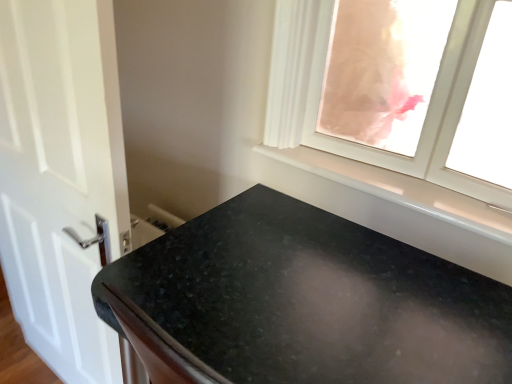
Question: From the image's perspective, is transparent glass window at upper right below black granite countertop at lower center?

Choices:
 (A) yes
 (B) no

Answer: (B)

Question: From a real-world perspective, is transparent glass window at upper right physically below black granite countertop at lower center?

Choices:
 (A) yes
 (B) no

Answer: (B)

Question: Does transparent glass window at upper right appear on the right side of black granite countertop at lower center?

Choices:
 (A) yes
 (B) no

Answer: (A)

Question: Considering the relative sizes of transparent glass window at upper right and black granite countertop at lower center in the image provided, is transparent glass window at upper right shorter than black granite countertop at lower center?

Choices:
 (A) yes
 (B) no

Answer: (A)

Question: Is transparent glass window at upper right bigger than black granite countertop at lower center?

Choices:
 (A) yes
 (B) no

Answer: (B)

Question: Can black granite countertop at lower center be found inside transparent glass window at upper right?

Choices:
 (A) yes
 (B) no

Answer: (B)

Question: Considering the relative sizes of white glossy door at left and white glossy window sill at upper right in the image provided, is white glossy door at left thinner than white glossy window sill at upper right?

Choices:
 (A) yes
 (B) no

Answer: (A)

Question: Considering the relative positions of white glossy door at left and white glossy window sill at upper right in the image provided, is white glossy door at left behind white glossy window sill at upper right?

Choices:
 (A) yes
 (B) no

Answer: (B)

Question: Is white glossy door at left closer to the viewer compared to white glossy window sill at upper right?

Choices:
 (A) yes
 (B) no

Answer: (A)

Question: Can you confirm if white glossy door at left is taller than white glossy window sill at upper right?

Choices:
 (A) no
 (B) yes

Answer: (B)

Question: Is white glossy door at left completely or partially outside of white glossy window sill at upper right?

Choices:
 (A) yes
 (B) no

Answer: (A)

Question: Considering the relative positions of white glossy door at left and white glossy window sill at upper right in the image provided, is white glossy door at left to the right of white glossy window sill at upper right from the viewer's perspective?

Choices:
 (A) yes
 (B) no

Answer: (B)

Question: From the image's perspective, is black granite countertop at lower center located beneath white glossy door at left?

Choices:
 (A) no
 (B) yes

Answer: (B)